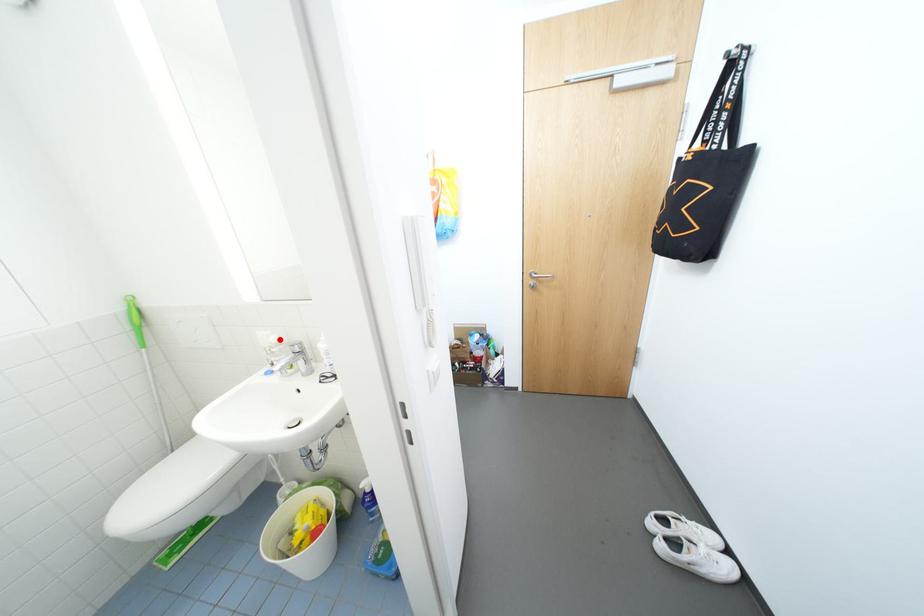
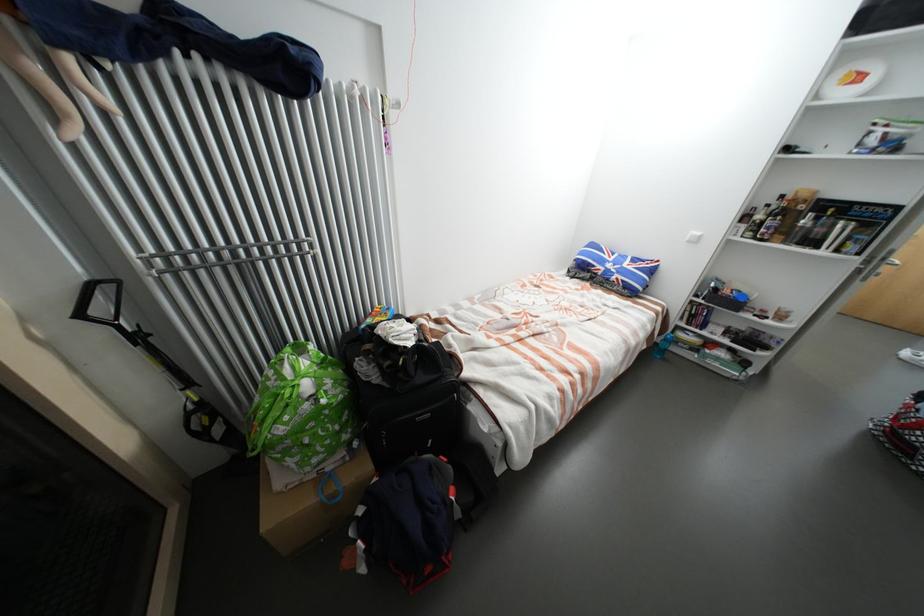
Question: I am providing you with two images of the same scene from different viewpoints. A red point is marked on the first image. Is the red point's position out of view in image 2?

Choices:
 (A) Yes
 (B) No

Answer: (A)